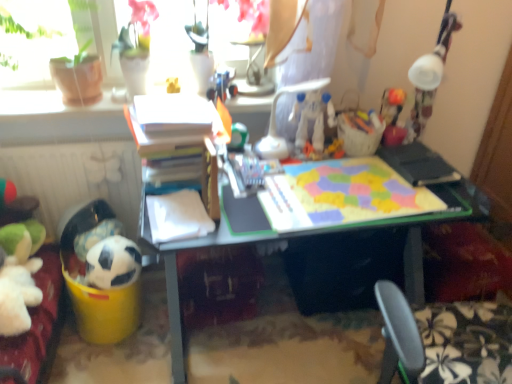
Question: Can you see white plastic chair at center touching matte plastic desk at center?

Choices:
 (A) yes
 (B) no

Answer: (B)

Question: From the image's perspective, is white plastic chair at center below matte plastic desk at center?

Choices:
 (A) no
 (B) yes

Answer: (A)

Question: Can you confirm if white plastic chair at center is shorter than matte plastic desk at center?

Choices:
 (A) yes
 (B) no

Answer: (A)

Question: Considering the relative sizes of white plastic chair at center and matte plastic desk at center in the image provided, is white plastic chair at center bigger than matte plastic desk at center?

Choices:
 (A) yes
 (B) no

Answer: (B)

Question: Is white plastic chair at center thinner than matte plastic desk at center?

Choices:
 (A) yes
 (B) no

Answer: (A)

Question: Considering their positions, is white plastic chair at center located in front of or behind matte plastic desk at center?

Choices:
 (A) front
 (B) behind

Answer: (B)

Question: From a real-world perspective, is white plastic chair at center positioned above or below matte plastic desk at center?

Choices:
 (A) above
 (B) below

Answer: (A)

Question: Based on their positions, is white plastic chair at center located to the left or right of matte plastic desk at center?

Choices:
 (A) right
 (B) left

Answer: (B)

Question: Does point (273, 94) appear closer or farther from the camera than point (170, 326)?

Choices:
 (A) farther
 (B) closer

Answer: (A)

Question: From their relative heights in the image, would you say white matte soccer ball at lower left is taller or shorter than white plastic chair at center?

Choices:
 (A) short
 (B) tall

Answer: (A)

Question: Is white matte soccer ball at lower left wider or thinner than white plastic chair at center?

Choices:
 (A) thin
 (B) wide

Answer: (A)

Question: Is point (132, 246) closer or farther from the camera than point (270, 119)?

Choices:
 (A) closer
 (B) farther

Answer: (A)

Question: Based on their positions, is white matte soccer ball at lower left located to the left or right of white plastic chair at center?

Choices:
 (A) left
 (B) right

Answer: (A)

Question: Visually, is yellow matte toy at upper center, which ranks as the 1th toy in top-to-bottom order, positioned to the left or to the right of white matte soccer ball at lower left, the first toy ordered from the bottom?

Choices:
 (A) left
 (B) right

Answer: (B)

Question: From the image's perspective, relative to white matte soccer ball at lower left, the fourth toy positioned from the top, is yellow matte toy at upper center, marked as the 3th toy in a right-to-left arrangement, above or below?

Choices:
 (A) above
 (B) below

Answer: (A)